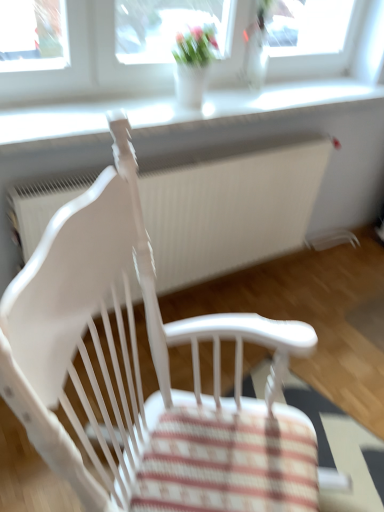
The height and width of the screenshot is (512, 384). What do you see at coordinates (230, 206) in the screenshot?
I see `white textured radiator at center` at bounding box center [230, 206].

Describe the element at coordinates (111, 333) in the screenshot. I see `white wood chair at center` at that location.

What do you see at coordinates (174, 112) in the screenshot? I see `white plastic window sill at upper center` at bounding box center [174, 112].

Locate an element on the screen. The width and height of the screenshot is (384, 512). white textured radiator at center is located at coordinates (230, 206).

Based on the photo, can you tell me how much white textured radiator at center and white wood chair at center differ in facing direction?

50.1 degrees separate the facing orientations of white textured radiator at center and white wood chair at center.

Is point (301, 170) behind point (100, 367)?

Yes.

Looking at this image, is white textured radiator at center to the left or to the right of white wood chair at center in the image?

Clearly, white textured radiator at center is on the left of white wood chair at center in the image.

Considering the relative sizes of white plastic window sill at upper center and white wood chair at center in the image provided, is white plastic window sill at upper center thinner than white wood chair at center?

Yes.

Locate an element on the screen. The image size is (384, 512). window sill above the white wood chair at center (from a real-world perspective) is located at coordinates (174, 112).

Can you confirm if white plastic window sill at upper center is bigger than white wood chair at center?

Actually, white plastic window sill at upper center might be smaller than white wood chair at center.

Considering the positions of objects white plastic window sill at upper center and white wood chair at center in the image provided, who is behind, white plastic window sill at upper center or white wood chair at center?

Positioned behind is white plastic window sill at upper center.

Is white wood chair at center oriented towards white plastic window sill at upper center?

No.

Who is bigger, white wood chair at center or white plastic window sill at upper center?

With larger size is white wood chair at center.

Is white wood chair at center touching white plastic window sill at upper center?

No, white wood chair at center is not in contact with white plastic window sill at upper center.

Identify the location of window sill behind the white wood chair at center. The height and width of the screenshot is (512, 384). (174, 112).

Locate an element on the screen. radiator directly beneath the white plastic window sill at upper center (from a real-world perspective) is located at coordinates (230, 206).

Which is less distant, (383, 93) or (181, 207)?

Positioned in front is point (181, 207).

Can you confirm if white plastic window sill at upper center is shorter than white textured radiator at center?

Indeed, white plastic window sill at upper center has a lesser height compared to white textured radiator at center.

Between white textured radiator at center and white plastic window sill at upper center, which one appears on the left side from the viewer's perspective?

Positioned to the left is white textured radiator at center.

From the image's perspective, which object appears higher, white textured radiator at center or white plastic window sill at upper center?

white plastic window sill at upper center appears higher in the image.

Is white textured radiator at center wider or thinner than white plastic window sill at upper center?

Considering their sizes, white textured radiator at center looks slimmer than white plastic window sill at upper center.

Would you say white textured radiator at center is inside or outside white plastic window sill at upper center?

white textured radiator at center lies outside white plastic window sill at upper center.

Is white wood chair at center placed right next to white textured radiator at center?

No, white wood chair at center is not making contact with white textured radiator at center.

From a real-world perspective, is white wood chair at center below white textured radiator at center?

No.

Is white wood chair at center completely or partially outside of white textured radiator at center?

Indeed, white wood chair at center is completely outside white textured radiator at center.

Considering the sizes of objects white wood chair at center and white textured radiator at center in the image provided, who is shorter, white wood chair at center or white textured radiator at center?

white textured radiator at center is shorter.

The width and height of the screenshot is (384, 512). In order to click on radiator behind the white wood chair at center in this screenshot , I will do `click(230, 206)`.

At what (x,y) coordinates should I click in order to perform the action: click on window sill lying above the white wood chair at center (from the image's perspective). Please return your answer as a coordinate pair (x, y). Image resolution: width=384 pixels, height=512 pixels. Looking at the image, I should click on (174, 112).

Estimate the real-world distances between objects in this image. Which object is further from white plastic window sill at upper center, white textured radiator at center or white wood chair at center?

white wood chair at center.

When comparing their distances from white wood chair at center, does white textured radiator at center or white plastic window sill at upper center seem closer?

white textured radiator at center.

Looking at the image, which one is located further to white textured radiator at center, white wood chair at center or white plastic window sill at upper center?

Among the two, white wood chair at center is located further to white textured radiator at center.

Which object lies further to the anchor point white textured radiator at center, white plastic window sill at upper center or white wood chair at center?

white wood chair at center.

From the image, which object appears to be nearer to white wood chair at center, white plastic window sill at upper center or white textured radiator at center?

Based on the image, white textured radiator at center appears to be nearer to white wood chair at center.

Based on their spatial positions, is white wood chair at center or white textured radiator at center further from white plastic window sill at upper center?

Among the two, white wood chair at center is located further to white plastic window sill at upper center.

Where is `window sill located between white wood chair at center and white textured radiator at center in the depth direction`? window sill located between white wood chair at center and white textured radiator at center in the depth direction is located at coordinates (174, 112).